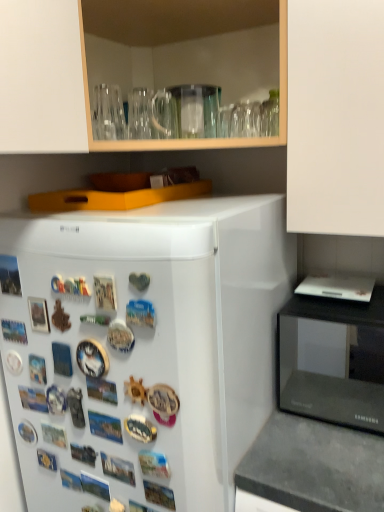
This screenshot has height=512, width=384. Find the location of `vacant point above dark gray concrete counter top at lower right (from a real-world perspective)`. vacant point above dark gray concrete counter top at lower right (from a real-world perspective) is located at coordinates (325, 448).